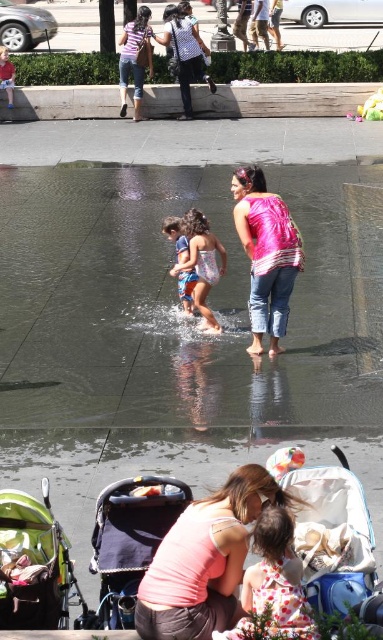
You are a parent with a baby in a green fabric stroller at lower left. You want to push the stroller through the clear water at center to reach the other side. Based on the scene description, can the stroller pass through the water area without getting stuck?

The clear water at center is wider than the green fabric stroller at lower left, so the stroller can pass through the water area without getting stuck.

You are a fashion designer observing the scene. You notice the pink satin blouse at center and the light blue denim shorts at center. Which clothing item is wider?

The pink satin blouse at center is wider than the light blue denim shorts at center according to the description.